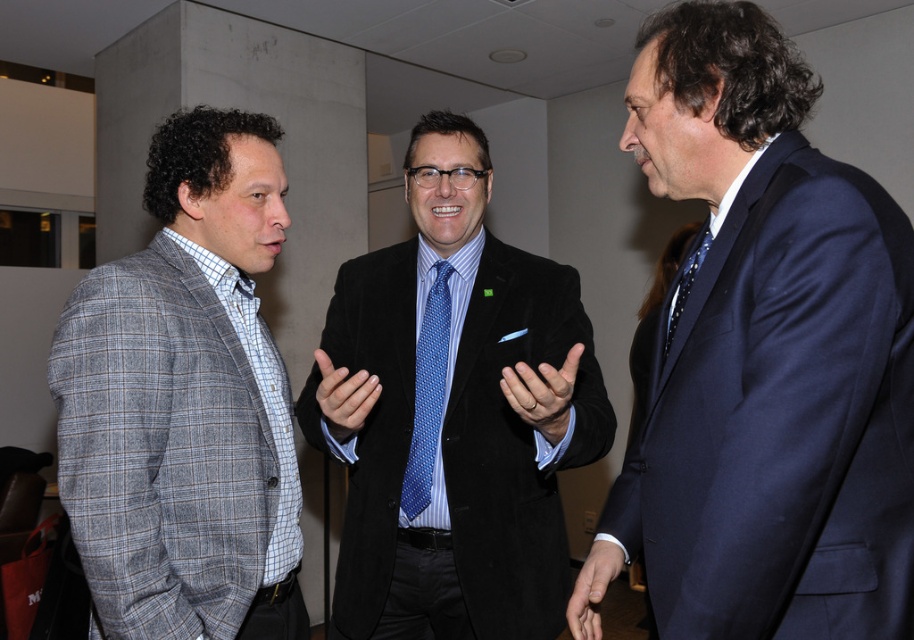
Question: Among these points, which one is nearest to the camera?

Choices:
 (A) (200, 269)
 (B) (431, 392)

Answer: (A)

Question: Which of the following is the closest to the observer?

Choices:
 (A) polka dot silk tie at center
 (B) gray plaid blazer at left
 (C) velvet black suit at center
 (D) blue dotted tie at center

Answer: (A)

Question: Considering the relative positions of navy blue suit at right and blue dotted tie at center in the image provided, where is navy blue suit at right located with respect to blue dotted tie at center?

Choices:
 (A) below
 (B) above

Answer: (B)

Question: Can you confirm if velvet black suit at center is wider than blue dotted tie at center?

Choices:
 (A) yes
 (B) no

Answer: (A)

Question: Which of these objects is positioned closest to the blue dotted tie at center?

Choices:
 (A) polka dot silk tie at center
 (B) velvet black suit at center
 (C) navy blue suit at right

Answer: (B)

Question: Is gray plaid blazer at left to the right of blue dotted tie at center from the viewer's perspective?

Choices:
 (A) yes
 (B) no

Answer: (B)